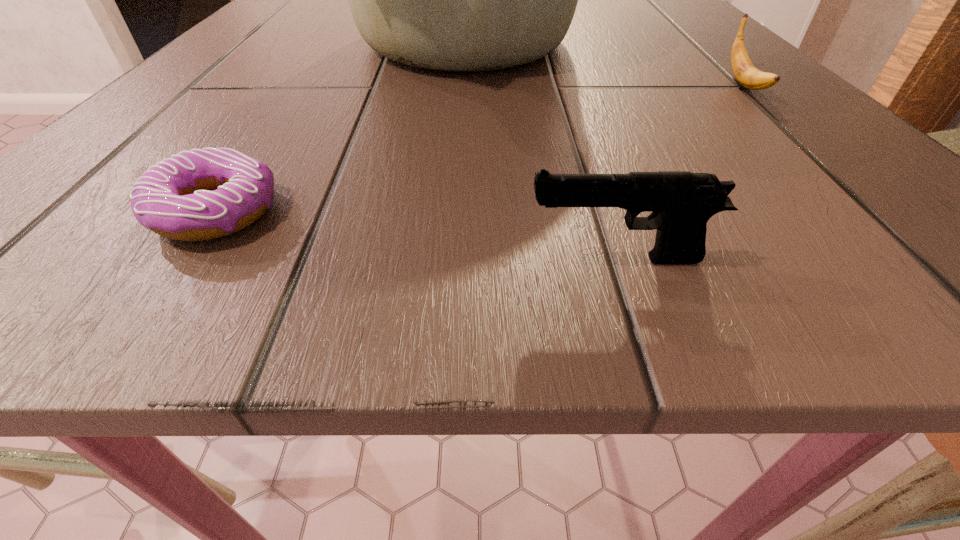
Find the location of a particular element. saucepan is located at coordinates (461, 0).

The width and height of the screenshot is (960, 540). What are the coordinates of `pistol` in the screenshot? It's located at (681, 202).

The width and height of the screenshot is (960, 540). Find the location of `the rightmost object`. the rightmost object is located at coordinates (746, 74).

Where is `doughnut`? The image size is (960, 540). doughnut is located at coordinates (174, 199).

Where is `free space located on the front of the saucepan`? The image size is (960, 540). free space located on the front of the saucepan is located at coordinates 460,129.

This screenshot has width=960, height=540. I want to click on free location located 0.390m on the front-facing side of the pistol, so click(x=24, y=259).

At what (x,y) coordinates should I click in order to perform the action: click on blank area located on the front-facing side of the pistol. Please return your answer as a coordinate pair (x, y). The width and height of the screenshot is (960, 540). Looking at the image, I should click on (411, 259).

At what (x,y) coordinates should I click in order to perform the action: click on free space located 0.150m on the front-facing side of the pistol. Please return your answer as a coordinate pair (x, y). This screenshot has height=540, width=960. Looking at the image, I should click on (334, 259).

Where is `free space located 0.180m on the peel of the banana from the top`? The width and height of the screenshot is (960, 540). free space located 0.180m on the peel of the banana from the top is located at coordinates (854, 191).

Identify the location of vacant space located on the right of the shortest object. (461, 212).